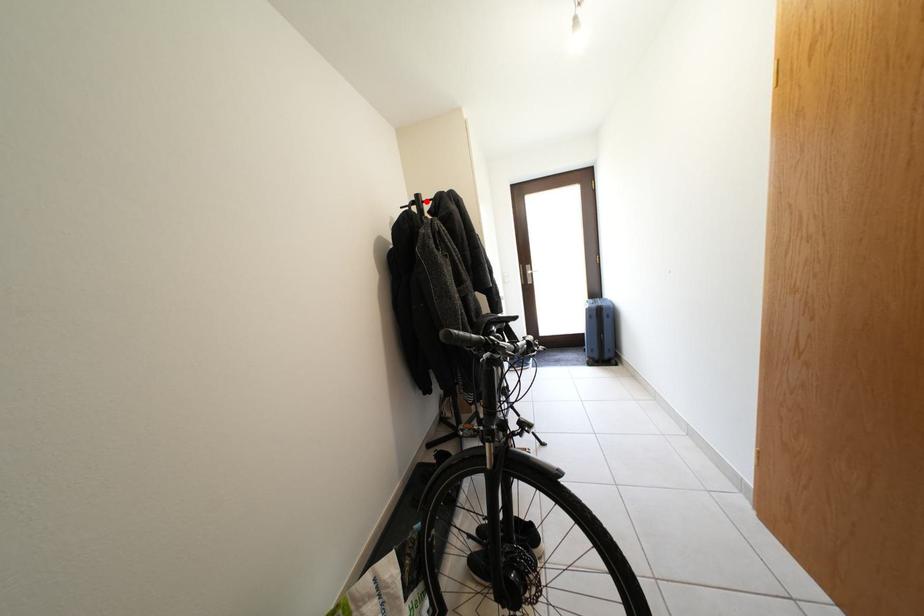
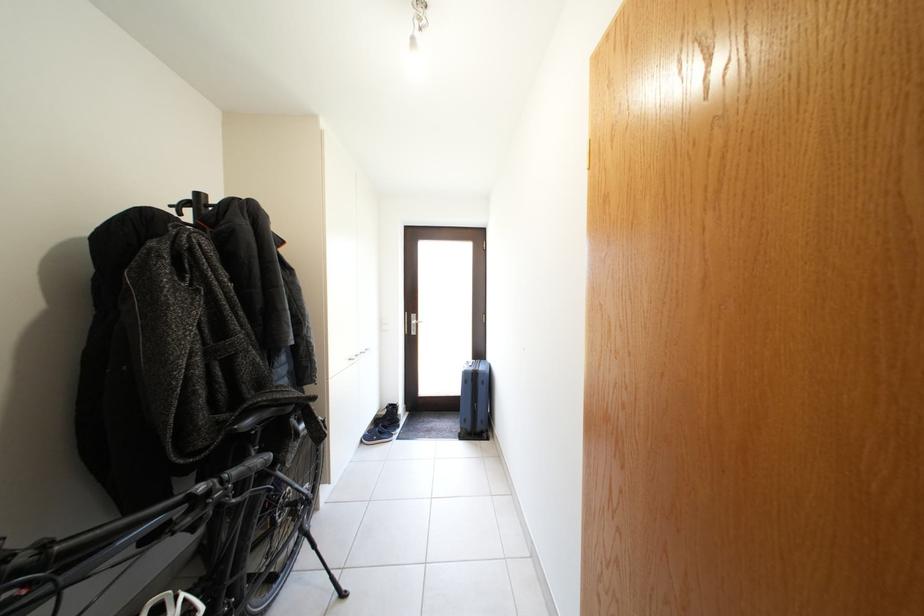
In the second image, find the point that corresponds to the highlighted location in the first image.

(205, 200)